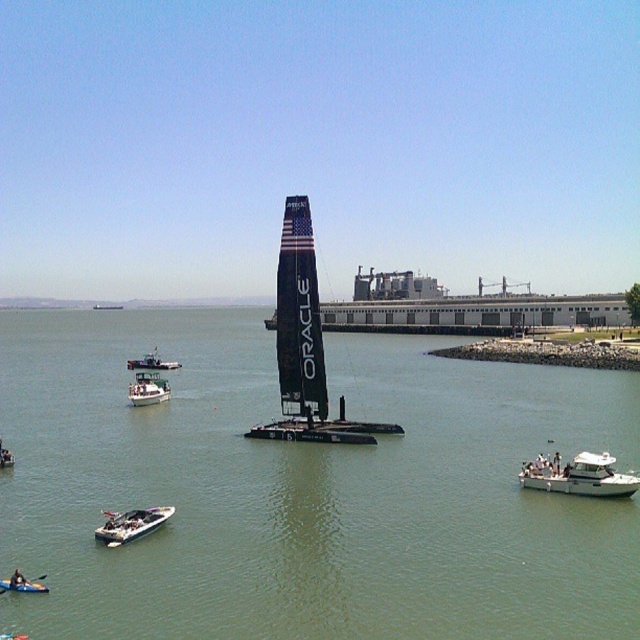
Question: Among these points, which one is farthest from the camera?

Choices:
 (A) (141, 362)
 (B) (13, 458)
 (C) (8, 477)

Answer: (A)

Question: Is white glossy sailboat at center smaller than white plastic boat at center-right?

Choices:
 (A) yes
 (B) no

Answer: (B)

Question: Which object is closer to the camera taking this photo?

Choices:
 (A) white plastic kayak at lower left
 (B) white glossy speedboat at lower left
 (C) greenish water at center
 (D) white glossy kayak at lower left

Answer: (C)

Question: Does white glossy kayak at lower left have a greater width compared to dark blue wetsuit at lower left?

Choices:
 (A) yes
 (B) no

Answer: (A)

Question: Can you confirm if white glossy speedboat at lower left is positioned to the left of white glossy sailboat at center?

Choices:
 (A) no
 (B) yes

Answer: (A)

Question: Which point appears closest to the camera in this image?

Choices:
 (A) (147, 369)
 (B) (129, 518)

Answer: (B)